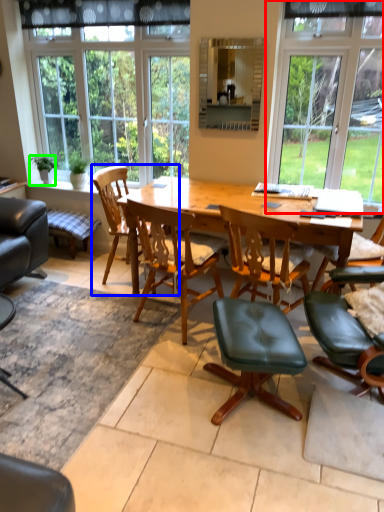
Question: Which object is positioned closest to window (highlighted by a red box)? Select from chair (highlighted by a blue box) and houseplant (highlighted by a green box).

Choices:
 (A) chair
 (B) houseplant

Answer: (A)